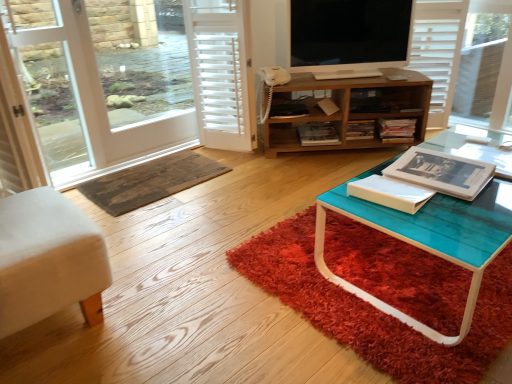
In order to click on free space between white fabric cushion at lower left and wooden textured doormat at center, the second doormat when ordered from right to left in this screenshot , I will do `click(155, 221)`.